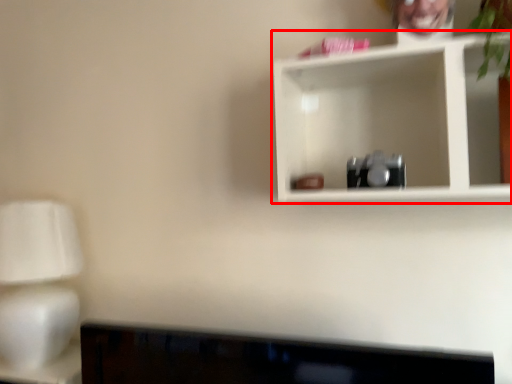
Question: From the image's perspective, what is the correct spatial positioning of shelf (annotated by the red box) in reference to table lamp?

Choices:
 (A) above
 (B) below

Answer: (A)